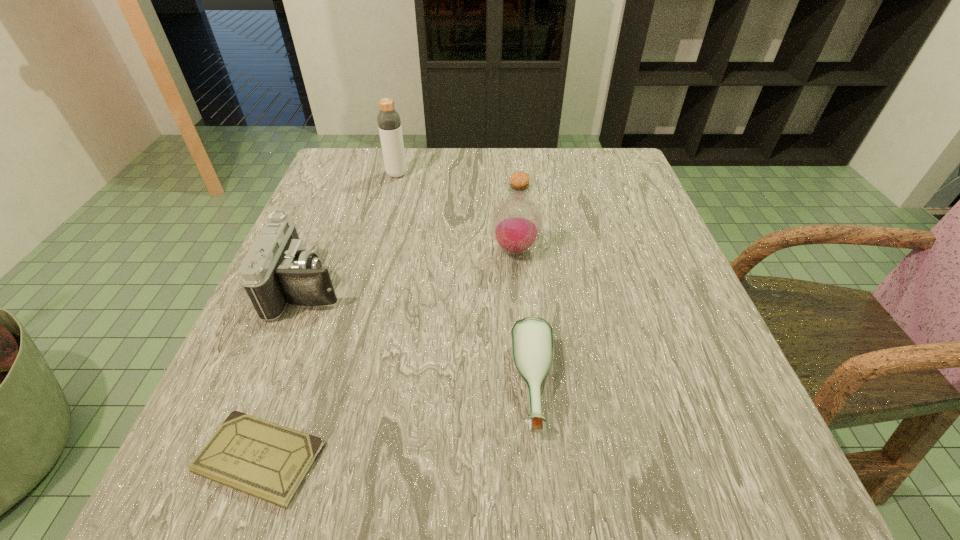
You are a GUI agent. You are given a task and a screenshot of the screen. Output one action in this format:
    pyautogui.click(x=<x>, y=<y>)
    Task: Click on the free space that satisfies the following two spatial constraints: 1. on the back side of the shortest bottle; 2. at the front of the third tallest object with an open lens cover
    Image resolution: width=960 pixels, height=540 pixels.
    Given the screenshot: What is the action you would take?
    pyautogui.click(x=523, y=287)

Locate an element on the screen. This screenshot has width=960, height=540. free point that satisfies the following two spatial constraints: 1. on the front side of the second farthest bottle; 2. at the front of the camera with an open lens cover is located at coordinates (518, 287).